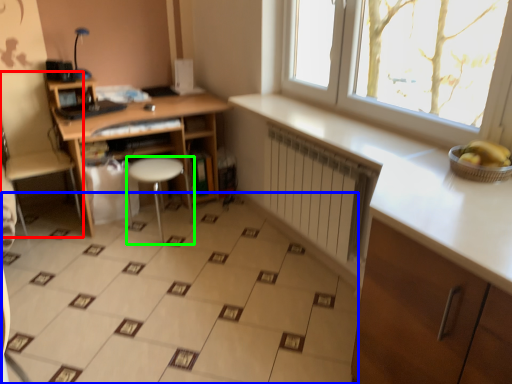
Question: Which object is positioned farthest from swivel chair (highlighted by a red box)? Select from ceramic tile (highlighted by a blue box) and stool (highlighted by a green box).

Choices:
 (A) ceramic tile
 (B) stool

Answer: (A)